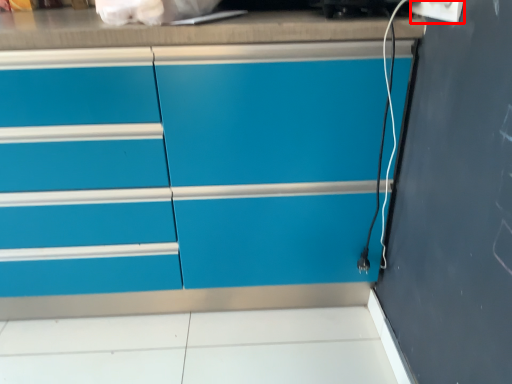
Question: From the image's perspective, what is the correct spatial positioning of electric outlet (annotated by the red box) in reference to chest of drawers?

Choices:
 (A) below
 (B) above

Answer: (B)